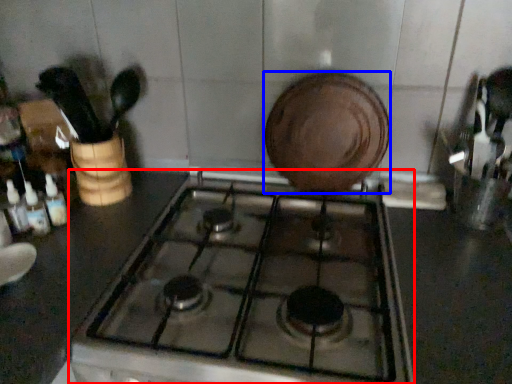
Question: Among these objects, which one is nearest to the camera, gas stove (highlighted by a red box) or kitchen appliance (highlighted by a blue box)?

Choices:
 (A) gas stove
 (B) kitchen appliance

Answer: (A)